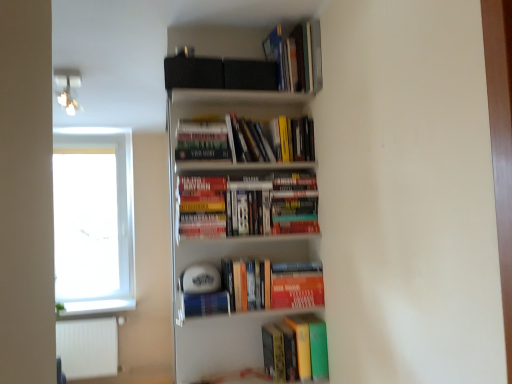
This screenshot has width=512, height=384. What do you see at coordinates (88, 347) in the screenshot? I see `white matte radiator at lower left` at bounding box center [88, 347].

Identify the location of white matte radiator at lower left. The height and width of the screenshot is (384, 512). coord(88,347).

Find the location of a particular element. This screenshot has width=512, height=384. hardcover books at upper center, which appears as the fourth book when ordered from the bottom is located at coordinates (297, 56).

What is the approximate height of hardcover books at upper center, which appears as the fourth book when ordered from the bottom?

It is 30.57 centimeters.

This screenshot has height=384, width=512. I want to click on hardcover books at upper center, which ranks as the 3th book in bottom-to-top order, so click(250, 140).

Identify the location of white glossy bookshelf at upper center. (239, 211).

In order to face orange matte paperback book at center, should I rotate leftwards or rightwards?

To face it directly, rotate right by 5.428 degrees.

What is the approximate width of orange matte paperback book at center?

2.55 inches.

Identify the location of green matte book at lower right, positioned as the fourth book in top-to-bottom order. (305, 347).

From a real-world perspective, is white matte radiator at lower left above or below hardcover books at upper center, which appears as the fourth book when ordered from the bottom?

white matte radiator at lower left is below hardcover books at upper center, which appears as the fourth book when ordered from the bottom.

Is point (89, 330) farther from viewer compared to point (283, 54)?

Yes, point (89, 330) is farther from viewer.

Considering the relative positions of white matte radiator at lower left and hardcover books at upper center, the first book when ordered from top to bottom, in the image provided, is white matte radiator at lower left to the right of hardcover books at upper center, the first book when ordered from top to bottom, from the viewer's perspective?

No.

Is white matte radiator at lower left bigger than hardcover books at upper center, which appears as the fourth book when ordered from the bottom?

Indeed, white matte radiator at lower left has a larger size compared to hardcover books at upper center, which appears as the fourth book when ordered from the bottom.

Considering the relative sizes of white glossy bookshelf at upper center and orange matte paperback book at center in the image provided, is white glossy bookshelf at upper center thinner than orange matte paperback book at center?

No, white glossy bookshelf at upper center is not thinner than orange matte paperback book at center.

Based on the photo, how many degrees apart are the facing directions of white glossy bookshelf at upper center and orange matte paperback book at center?

white glossy bookshelf at upper center and orange matte paperback book at center are facing 3.02 degrees away from each other.

Measure the distance from white glossy bookshelf at upper center to orange matte paperback book at center.

They are 15.37 inches apart.

Which object is closer to the camera, white glossy bookshelf at upper center or orange matte paperback book at center?

white glossy bookshelf at upper center is in front.

Is hardcover books at upper center, which ranks as the 3th book in bottom-to-top order, in contact with green matte book at lower right, positioned as the fourth book in top-to-bottom order?

hardcover books at upper center, which ranks as the 3th book in bottom-to-top order, and green matte book at lower right, positioned as the fourth book in top-to-bottom order, are clearly separated.

From the image's perspective, is hardcover books at upper center, which ranks as the 3th book in bottom-to-top order, over green matte book at lower right, which is the first book from bottom to top?

Yes, from the image's perspective, hardcover books at upper center, which ranks as the 3th book in bottom-to-top order, is on top of green matte book at lower right, which is the first book from bottom to top.

Based on the photo, in terms of width, does hardcover books at upper center, which ranks as the 3th book in bottom-to-top order, look wider or thinner when compared to green matte book at lower right, positioned as the fourth book in top-to-bottom order?

Clearly, hardcover books at upper center, which ranks as the 3th book in bottom-to-top order, has less width compared to green matte book at lower right, positioned as the fourth book in top-to-bottom order.

Can you confirm if hardcover books at upper center, which ranks as the 3th book in bottom-to-top order, is bigger than green matte book at lower right, which is the first book from bottom to top?

Indeed, hardcover books at upper center, which ranks as the 3th book in bottom-to-top order, has a larger size compared to green matte book at lower right, which is the first book from bottom to top.

From a real-world perspective, which object rests below the other?

From a 3D spatial view, white matte radiator at lower left is below.

From the image's perspective, is green matte book at lower right, which is the first book from bottom to top, on top of white matte radiator at lower left?

Correct, green matte book at lower right, which is the first book from bottom to top, appears higher than white matte radiator at lower left in the image.

Can you tell me how much green matte book at lower right, which is the first book from bottom to top, and white matte radiator at lower left differ in facing direction?

2.25 degrees separate the facing orientations of green matte book at lower right, which is the first book from bottom to top, and white matte radiator at lower left.

Is green matte book at lower right, positioned as the fourth book in top-to-bottom order, far from white matte radiator at lower left?

green matte book at lower right, positioned as the fourth book in top-to-bottom order, is far away from white matte radiator at lower left.

From a real-world perspective, which object stands above the other?

In real-world perspective, hardcover books at upper center, which ranks as the 3th book in bottom-to-top order, is above.

In the scene shown: Is white matte radiator at lower left facing away from hardcover books at upper center, arranged as the 2th book when viewed from the top?

No, hardcover books at upper center, arranged as the 2th book when viewed from the top, is not at the back of white matte radiator at lower left.

Is white matte radiator at lower left placed right next to hardcover books at upper center, which ranks as the 3th book in bottom-to-top order?

No.

How many degrees apart are the facing directions of white matte radiator at lower left and hardcover books at upper center, which ranks as the 3th book in bottom-to-top order?

2.25 degrees separate the facing orientations of white matte radiator at lower left and hardcover books at upper center, which ranks as the 3th book in bottom-to-top order.

Would you say hardcover books at upper center, which appears as the fourth book when ordered from the bottom, is to the left or to the right of white glossy bookshelf at upper center in the picture?

Clearly, hardcover books at upper center, which appears as the fourth book when ordered from the bottom, is on the right of white glossy bookshelf at upper center in the image.

Looking at this image, in terms of height, does hardcover books at upper center, which appears as the fourth book when ordered from the bottom, look taller or shorter compared to white glossy bookshelf at upper center?

Clearly, hardcover books at upper center, which appears as the fourth book when ordered from the bottom, is shorter compared to white glossy bookshelf at upper center.

Is hardcover books at upper center, the first book when ordered from top to bottom, spatially inside white glossy bookshelf at upper center, or outside of it?

The correct answer is: outside.

From the image's perspective, is white glossy bookshelf at upper center located above or below hardcover books at center, which appears as the second book when ordered from the bottom?

white glossy bookshelf at upper center is situated lower than hardcover books at center, which appears as the second book when ordered from the bottom, in the image.

Is hardcover books at center, the third book viewed from the top, at the back of white glossy bookshelf at upper center?

That's right, white glossy bookshelf at upper center is facing away from hardcover books at center, the third book viewed from the top.

Between white glossy bookshelf at upper center and hardcover books at center, which appears as the second book when ordered from the bottom, which one is positioned in front?

Positioned in front is white glossy bookshelf at upper center.

Who is bigger, white glossy bookshelf at upper center or hardcover books at center, the third book viewed from the top?

With larger size is white glossy bookshelf at upper center.

In order to click on the 4th book directly above the white matte radiator at lower left (from a real-world perspective) in this screenshot , I will do `click(297, 56)`.

You are a GUI agent. You are given a task and a screenshot of the screen. Output one action in this format:
    pyautogui.click(x=<x>, y=<y>)
    Task: Click on the bookcase to the left of orange matte paperback book at center
    
    Given the screenshot: What is the action you would take?
    pyautogui.click(x=239, y=211)

Which object lies further to the anchor point orange matte paperback book at center, white matte radiator at lower left or hardcover books at upper center, which appears as the fourth book when ordered from the bottom?

The object further to orange matte paperback book at center is white matte radiator at lower left.

From the image, which object appears to be farther from hardcover books at upper center, arranged as the 2th book when viewed from the top, orange matte paperback book at center or white matte radiator at lower left?

white matte radiator at lower left is further to hardcover books at upper center, arranged as the 2th book when viewed from the top.

Considering their positions, is green matte book at lower right, which is the first book from bottom to top, positioned closer to white glass window at left than white matte radiator at lower left?

white matte radiator at lower left is closer to white glass window at left.

Based on their spatial positions, is orange matte paperback book at center or green matte book at lower right, which is the first book from bottom to top, further from hardcover books at upper center, which ranks as the 3th book in bottom-to-top order?

green matte book at lower right, which is the first book from bottom to top, lies further to hardcover books at upper center, which ranks as the 3th book in bottom-to-top order, than the other object.

Considering their positions, is hardcover books at upper center, the first book when ordered from top to bottom, positioned further to white glass window at left than white glossy bookshelf at upper center?

Among the two, hardcover books at upper center, the first book when ordered from top to bottom, is located further to white glass window at left.

From the image, which object appears to be nearer to hardcover books at upper center, which appears as the fourth book when ordered from the bottom, white glass window at left or orange matte paperback book at center?

orange matte paperback book at center is positioned closer to the anchor hardcover books at upper center, which appears as the fourth book when ordered from the bottom.

From the image, which object appears to be farther from orange matte paperback book at center, green matte book at lower right, which is the first book from bottom to top, or hardcover books at upper center, arranged as the 2th book when viewed from the top?

hardcover books at upper center, arranged as the 2th book when viewed from the top, is further to orange matte paperback book at center.

Estimate the real-world distances between objects in this image. Which object is closer to white glass window at left, orange matte paperback book at center or green matte book at lower right, positioned as the fourth book in top-to-bottom order?

The object closer to white glass window at left is green matte book at lower right, positioned as the fourth book in top-to-bottom order.

The height and width of the screenshot is (384, 512). What are the coordinates of `bookcase between hardcover books at center, which appears as the second book when ordered from the bottom, and green matte book at lower right, which is the first book from bottom to top, from top to bottom` in the screenshot? It's located at (239, 211).

This screenshot has height=384, width=512. I want to click on bookcase between hardcover books at center, which appears as the second book when ordered from the bottom, and orange matte paperback book at center vertically, so click(x=239, y=211).

Locate an element on the screen. paperback book between hardcover books at center, which appears as the second book when ordered from the bottom, and white glass window at left, along the z-axis is located at coordinates (297, 285).

Where is `cabinet located between hardcover books at upper center, the first book when ordered from top to bottom, and white glass window at left in the depth direction`? cabinet located between hardcover books at upper center, the first book when ordered from top to bottom, and white glass window at left in the depth direction is located at coordinates (88, 347).